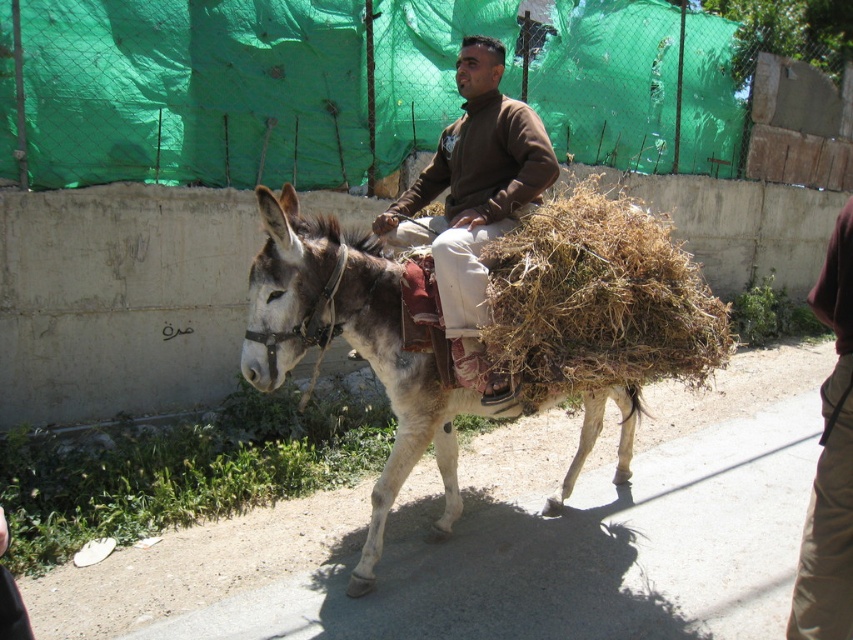
Question: Is brown dry grass at center to the right of brown cotton pants at lower right from the viewer's perspective?

Choices:
 (A) yes
 (B) no

Answer: (B)

Question: Does brown dry grass at center have a greater width compared to brown woolen sweater at center?

Choices:
 (A) yes
 (B) no

Answer: (A)

Question: Estimate the real-world distances between objects in this image. Which object is farther from the gray matte mule at center?

Choices:
 (A) brown woolen sweater at center
 (B) brown dry grass at center

Answer: (B)

Question: Which of these objects is positioned closest to the brown cotton pants at lower right?

Choices:
 (A) brown woolen sweater at center
 (B) brown dry grass at center

Answer: (B)

Question: Considering the real-world distances, which object is farthest from the brown woolen sweater at center?

Choices:
 (A) gray matte mule at center
 (B) brown dry grass at center

Answer: (A)

Question: In this image, where is gray matte mule at center located relative to brown woolen sweater at center?

Choices:
 (A) below
 (B) above

Answer: (A)